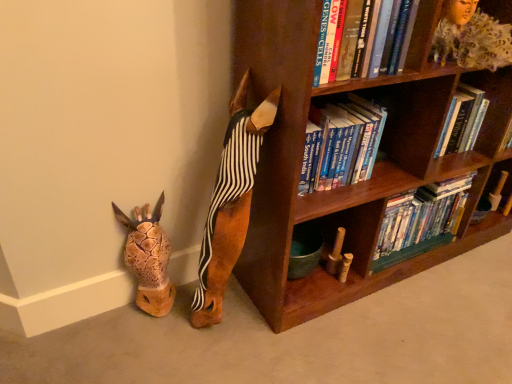
Identify the location of free spot to the right of wooden giraffe head at lower left, arranged as the first animal when viewed from the left. This screenshot has width=512, height=384. (188, 314).